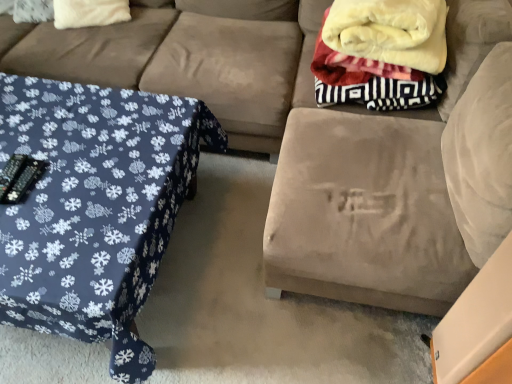
Question: Considering the positions of blue fabric table at left and white fluffy pillow at upper left in the image, is blue fabric table at left wider or thinner than white fluffy pillow at upper left?

Choices:
 (A) wide
 (B) thin

Answer: (A)

Question: Is blue fabric table at left spatially inside white fluffy pillow at upper left, or outside of it?

Choices:
 (A) outside
 (B) inside

Answer: (A)

Question: Based on their relative distances, which object is farther from the suede couch at upper left?

Choices:
 (A) white fluffy pillow at upper left
 (B) suede ottoman at center
 (C) soft fleece blanket at upper right
 (D) blue fabric table at left

Answer: (B)

Question: Estimate the real-world distances between objects in this image. Which object is farther from the white fluffy pillow at upper left?

Choices:
 (A) suede ottoman at center
 (B) suede couch at upper left
 (C) soft fleece blanket at upper right
 (D) blue fabric table at left

Answer: (A)